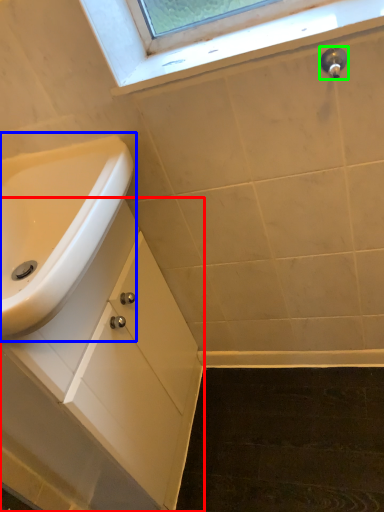
Question: Which object is the closest to the bathroom cabinet (highlighted by a red box)? Choose among these: sink (highlighted by a blue box) or plumbing fixture (highlighted by a green box).

Choices:
 (A) sink
 (B) plumbing fixture

Answer: (A)